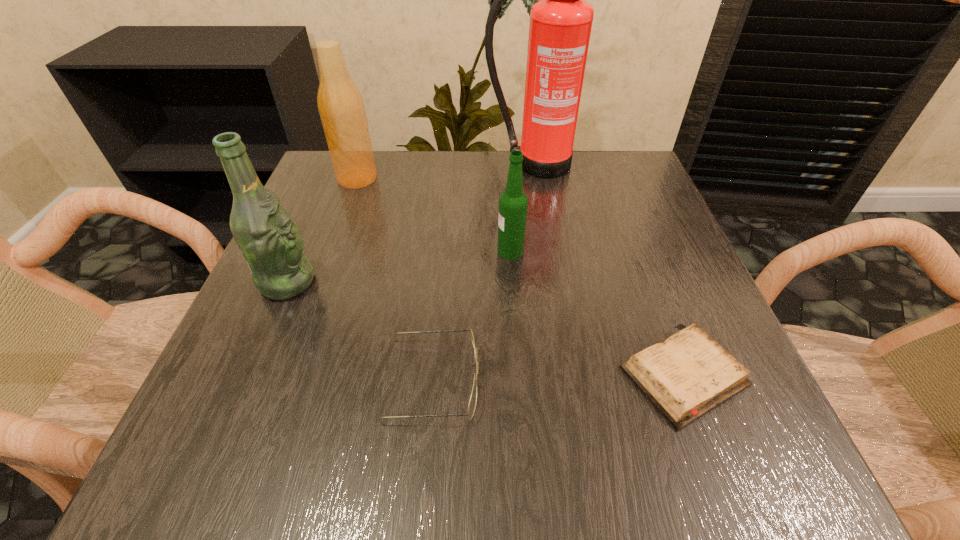
Where is `the tallest object`? This screenshot has height=540, width=960. the tallest object is located at coordinates click(x=560, y=26).

This screenshot has height=540, width=960. In order to click on the farthest beer bottle in this screenshot , I will do `click(341, 107)`.

The width and height of the screenshot is (960, 540). In order to click on the fourth farthest object in this screenshot , I will do 265,233.

The height and width of the screenshot is (540, 960). I want to click on the third shortest object, so click(x=513, y=203).

I want to click on the rightmost beer bottle, so [513, 203].

At what (x,y) coordinates should I click in order to perform the action: click on the third object from left to right. Please return your answer as a coordinate pair (x, y). Looking at the image, I should click on (473, 398).

Find the location of a particular element. The width and height of the screenshot is (960, 540). the second shortest object is located at coordinates (473, 398).

Where is `the shortest object`? The height and width of the screenshot is (540, 960). the shortest object is located at coordinates (688, 374).

Where is `vacant region located 0.120m at the nozzle of the fire extinguisher`? This screenshot has width=960, height=540. vacant region located 0.120m at the nozzle of the fire extinguisher is located at coordinates (539, 210).

You are a GUI agent. You are given a task and a screenshot of the screen. Output one action in this format:
    pyautogui.click(x=<x>, y=<y>)
    Task: Click on the vacant area situated on the front of the farthest beer bottle
    
    Given the screenshot: What is the action you would take?
    pyautogui.click(x=319, y=285)